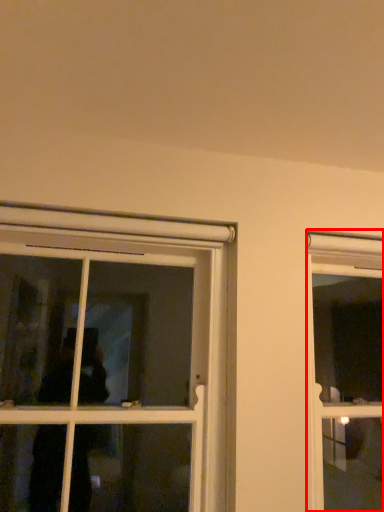
Question: From the image's perspective, considering the relative positions of window (annotated by the red box) and window in the image provided, where is window (annotated by the red box) located with respect to the staircase?

Choices:
 (A) above
 (B) below

Answer: (B)